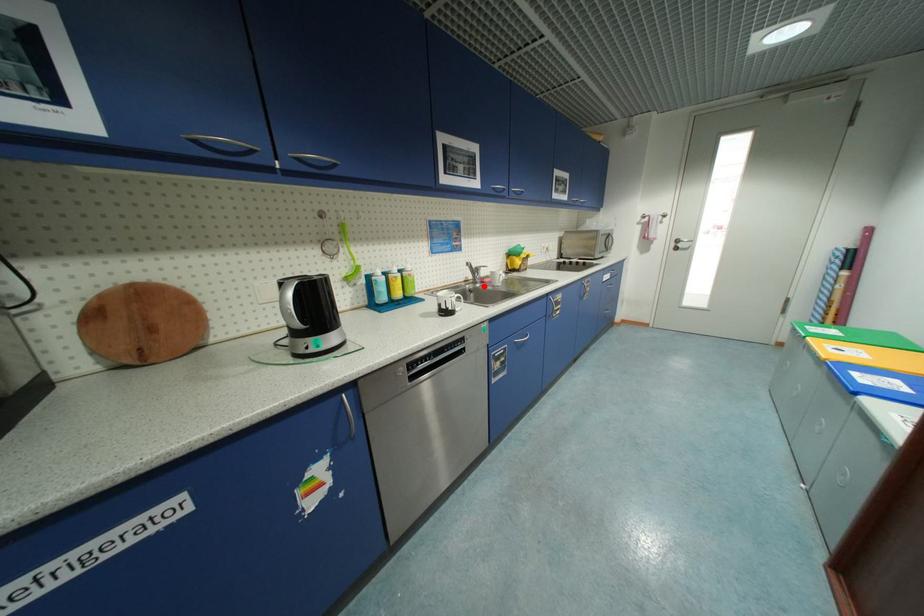
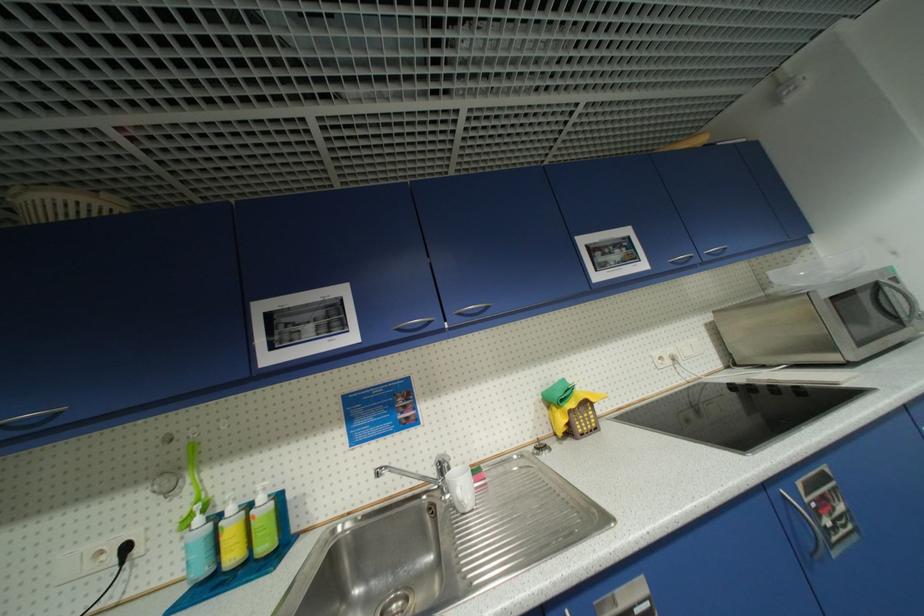
In the second image, find the point that corresponds to the highlighted location in the first image.

(454, 496)